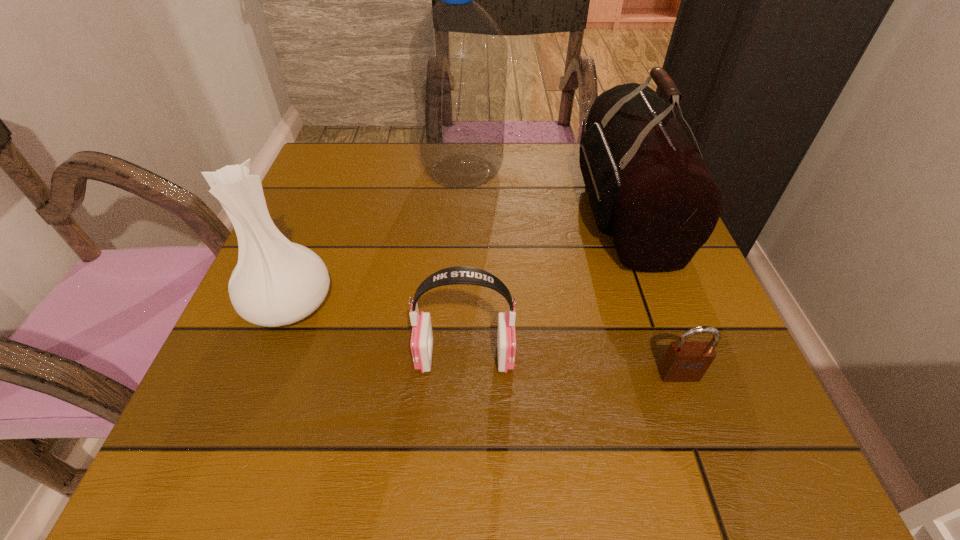
Find the location of a particular element. This screenshot has width=960, height=540. the tallest object is located at coordinates (458, 54).

I want to click on duffel bag, so click(649, 189).

In order to click on the leftmost object in this screenshot , I will do `click(276, 282)`.

Find the location of a particular element. This screenshot has height=540, width=960. the second shortest object is located at coordinates (422, 337).

Locate an element on the screen. This screenshot has height=540, width=960. the shortest object is located at coordinates tap(684, 361).

At what (x,y) coordinates should I click in order to perform the action: click on vacant space located on the right of the water jug. Please return your answer as a coordinate pair (x, y). The width and height of the screenshot is (960, 540). Looking at the image, I should click on (536, 171).

Find the location of `vacant space situated on the front pocket of the duffel bag`. vacant space situated on the front pocket of the duffel bag is located at coordinates (507, 210).

Where is `free space located on the front pocket of the duffel bag`? free space located on the front pocket of the duffel bag is located at coordinates (502, 210).

Where is `free space located 0.360m on the front pocket of the duffel bag`? Image resolution: width=960 pixels, height=540 pixels. free space located 0.360m on the front pocket of the duffel bag is located at coordinates (416, 210).

Find the location of `vacant space located 0.110m on the back of the leftmost object`. vacant space located 0.110m on the back of the leftmost object is located at coordinates click(x=318, y=235).